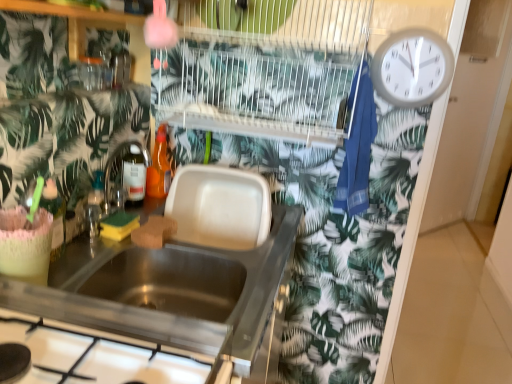
Question: Does white plastic wall clock at upper right come in front of translucent orange bottle at sink, the 1th bottle positioned from the back?

Choices:
 (A) yes
 (B) no

Answer: (A)

Question: From the image's perspective, is white plastic wall clock at upper right located above translucent orange bottle at sink, which is the second bottle from left to right?

Choices:
 (A) no
 (B) yes

Answer: (B)

Question: Are white plastic wall clock at upper right and translucent orange bottle at sink, acting as the first bottle starting from the right, located far from each other?

Choices:
 (A) no
 (B) yes

Answer: (A)

Question: Considering the relative sizes of white plastic wall clock at upper right and translucent orange bottle at sink, placed as the 2th bottle when sorted from bottom to top, in the image provided, is white plastic wall clock at upper right wider than translucent orange bottle at sink, placed as the 2th bottle when sorted from bottom to top,?

Choices:
 (A) no
 (B) yes

Answer: (A)

Question: Does white plastic wall clock at upper right appear on the right side of translucent orange bottle at sink, the 1th bottle positioned from the back?

Choices:
 (A) no
 (B) yes

Answer: (B)

Question: Considering the positions of translucent orange bottle at sink, which is the first bottle in top-to-bottom order, and stainless steel gas stove at lower left in the image, is translucent orange bottle at sink, which is the first bottle in top-to-bottom order, wider or thinner than stainless steel gas stove at lower left?

Choices:
 (A) wide
 (B) thin

Answer: (B)

Question: Looking at the image, does translucent orange bottle at sink, placed as the 2th bottle when sorted from bottom to top, seem bigger or smaller compared to stainless steel gas stove at lower left?

Choices:
 (A) small
 (B) big

Answer: (A)

Question: Would you say translucent orange bottle at sink, placed as the 2th bottle when sorted from bottom to top, is to the left or to the right of stainless steel gas stove at lower left in the picture?

Choices:
 (A) right
 (B) left

Answer: (B)

Question: From a real-world perspective, is translucent orange bottle at sink, acting as the first bottle starting from the right, positioned above or below stainless steel gas stove at lower left?

Choices:
 (A) above
 (B) below

Answer: (A)

Question: Based on their positions, is green sponge at sink, arranged as the second food when viewed from the right, located to the left or right of translucent orange bottle at sink, acting as the first bottle starting from the right?

Choices:
 (A) left
 (B) right

Answer: (A)

Question: In terms of size, does green sponge at sink, positioned as the first food in left-to-right order, appear bigger or smaller than translucent orange bottle at sink, which is the first bottle in top-to-bottom order?

Choices:
 (A) small
 (B) big

Answer: (A)

Question: From the image's perspective, is green sponge at sink, arranged as the second food when viewed from the right, above or below translucent orange bottle at sink, the 1th bottle positioned from the back?

Choices:
 (A) below
 (B) above

Answer: (A)

Question: Considering the positions of green sponge at sink, positioned as the first food in left-to-right order, and translucent orange bottle at sink, which is the first bottle in top-to-bottom order, in the image, is green sponge at sink, positioned as the first food in left-to-right order, wider or thinner than translucent orange bottle at sink, which is the first bottle in top-to-bottom order,?

Choices:
 (A) thin
 (B) wide

Answer: (A)

Question: From the image's perspective, is stainless steel gas stove at lower left above or below brown sponge at sink, placed as the first food when sorted from right to left?

Choices:
 (A) above
 (B) below

Answer: (B)

Question: Is point (89, 357) positioned closer to the camera than point (164, 238)?

Choices:
 (A) closer
 (B) farther

Answer: (A)